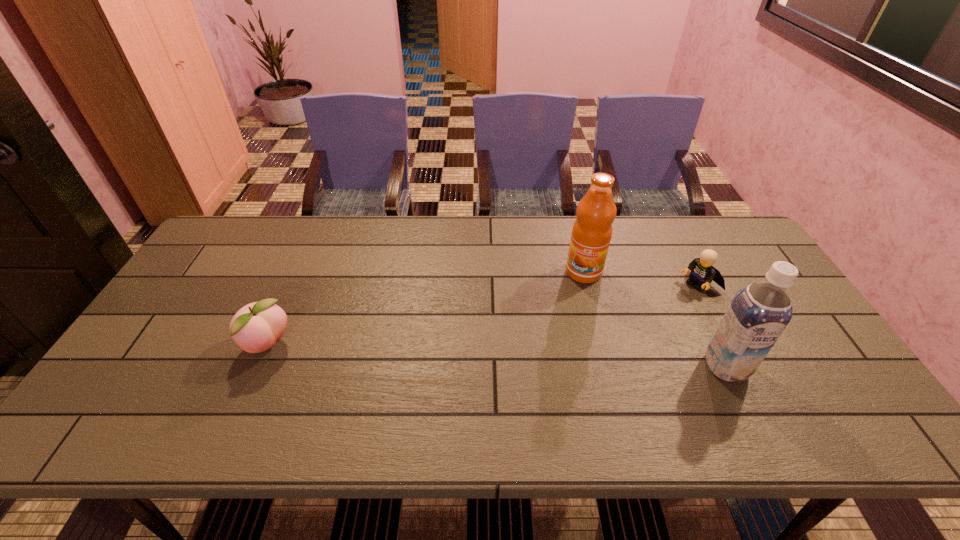
Where is `the leftmost object`? the leftmost object is located at coordinates (256, 327).

Locate an element on the screen. soya milk is located at coordinates (758, 314).

Locate an element on the screen. This screenshot has height=540, width=960. Lego is located at coordinates (702, 273).

You are a GUI agent. You are given a task and a screenshot of the screen. Output one action in this format:
    pyautogui.click(x=<x>, y=<y>)
    Task: Click on the second object from left to right
    This screenshot has height=540, width=960.
    Given the screenshot: What is the action you would take?
    pyautogui.click(x=591, y=234)

At what (x,y) coordinates should I click in order to perform the action: click on blank space located on the back of the leftmost object. Please return your answer as a coordinate pair (x, y). This screenshot has width=960, height=540. Looking at the image, I should click on (293, 290).

Where is `vacant area situated on the front-facing side of the Lego`? The height and width of the screenshot is (540, 960). vacant area situated on the front-facing side of the Lego is located at coordinates click(666, 301).

You are a GUI agent. You are given a task and a screenshot of the screen. Output one action in this format:
    pyautogui.click(x=<x>, y=<y>)
    Task: Click on the vacant space located on the front-facing side of the Lego
    
    Given the screenshot: What is the action you would take?
    pyautogui.click(x=651, y=309)

At what (x,y) coordinates should I click in order to perform the action: click on vacant region located on the front-facing side of the Lego. Please return your answer as a coordinate pair (x, y). Looking at the image, I should click on (663, 302).

The width and height of the screenshot is (960, 540). I want to click on free region located on the label side of the second object from left to right, so click(549, 359).

Where is `free region located on the label side of the second object from left to right`? Image resolution: width=960 pixels, height=540 pixels. free region located on the label side of the second object from left to right is located at coordinates (565, 318).